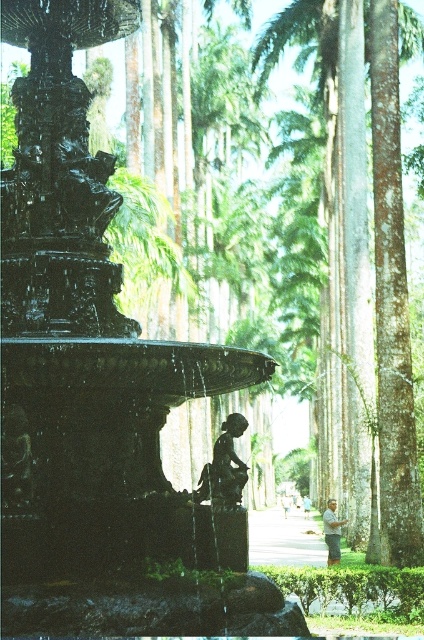
Question: Is bronze statue at center above light brown wood pole at lower right?

Choices:
 (A) yes
 (B) no

Answer: (A)

Question: Is bronze statue at center thinner than light blue fabric shirt at center?

Choices:
 (A) yes
 (B) no

Answer: (A)

Question: Can you confirm if green textured palm tree at center is positioned below light blue fabric shirt at center?

Choices:
 (A) no
 (B) yes

Answer: (A)

Question: Which object appears farthest from the camera in this image?

Choices:
 (A) light brown wood pole at lower right
 (B) bronze statue at center

Answer: (A)

Question: Which object appears closest to the camera in this image?

Choices:
 (A) bronze statue at center
 (B) light brown wood pole at lower right
 (C) green textured palm tree at center

Answer: (A)

Question: Which object is farther from the camera taking this photo?

Choices:
 (A) shiny black fountain at center
 (B) light blue fabric shirt at center
 (C) light brown wooden bench at center

Answer: (B)